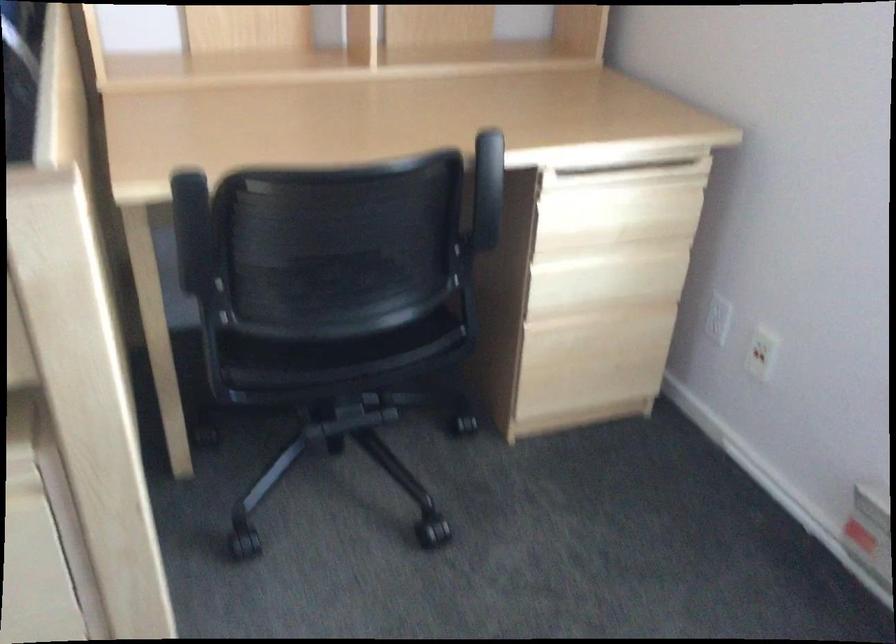
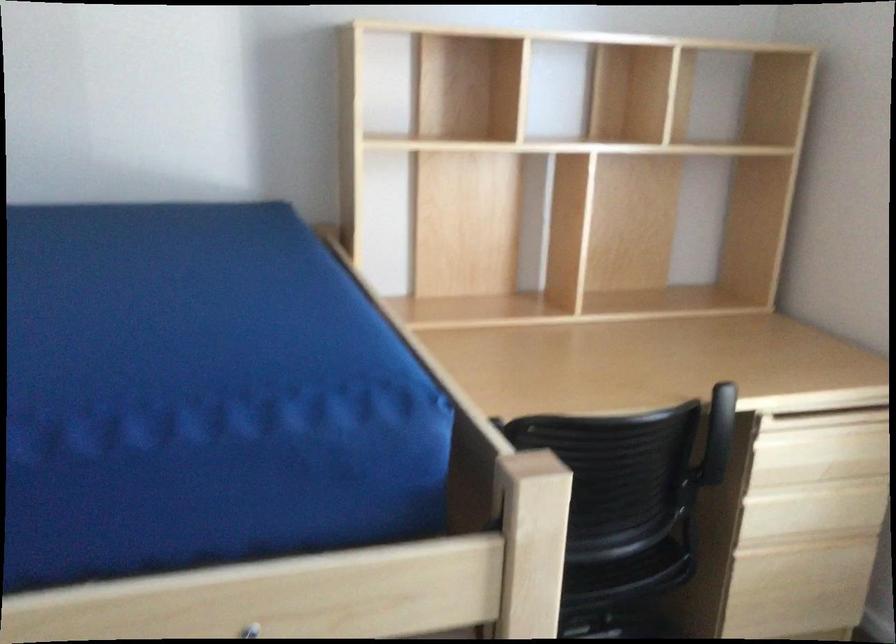
Locate, in the second image, the point that corresponds to pixel 614 213 in the first image.

(819, 450)